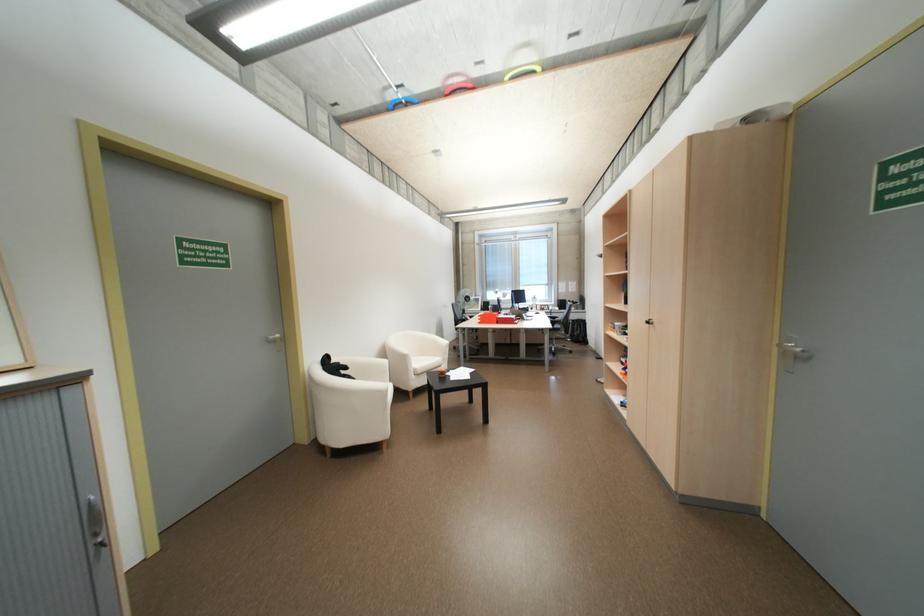
This screenshot has height=616, width=924. I want to click on grey cabinet handle, so click(95, 522).